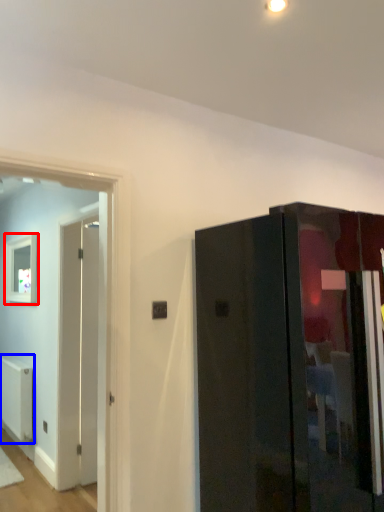
Question: Which object is closer to the camera taking this photo, picture frame (highlighted by a red box) or radiator (highlighted by a blue box)?

Choices:
 (A) picture frame
 (B) radiator

Answer: (B)